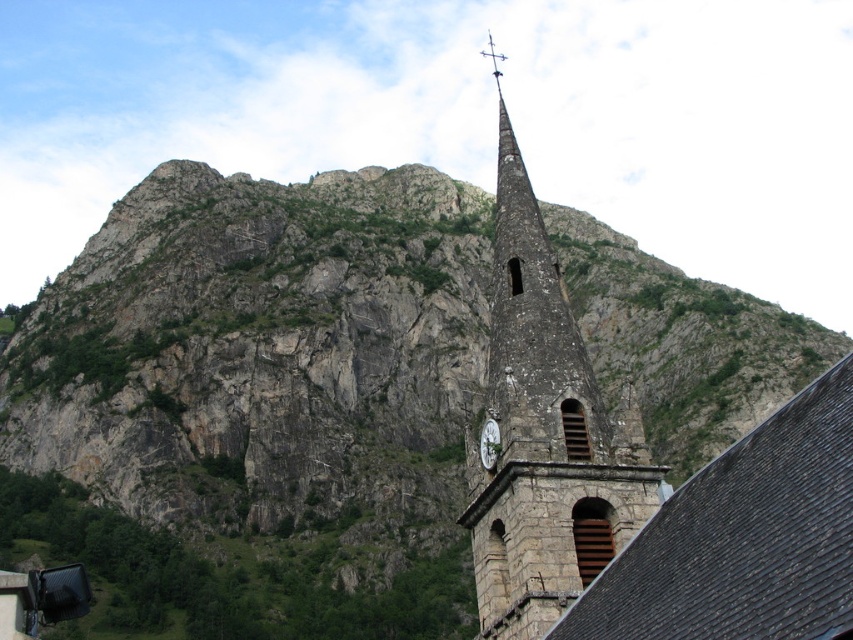
Who is lower down, stone clock tower at center or white stone clock at center?

white stone clock at center

Does stone clock tower at center come behind white stone clock at center?

No, it is in front of white stone clock at center.

In order to click on stone clock tower at center in this screenshot , I will do pyautogui.click(x=544, y=433).